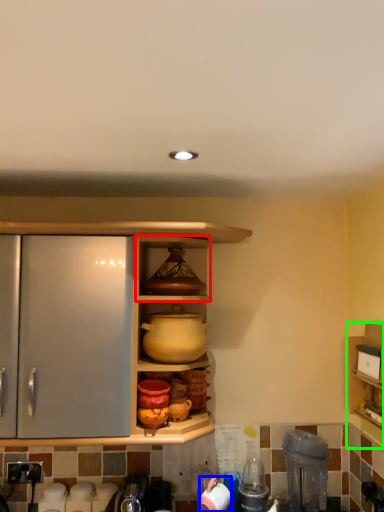
Question: Estimate the real-world distances between objects in this image. Which object is farther from cabinet (highlighted by a red box), appliance (highlighted by a blue box) or shelf (highlighted by a green box)?

Choices:
 (A) appliance
 (B) shelf

Answer: (A)